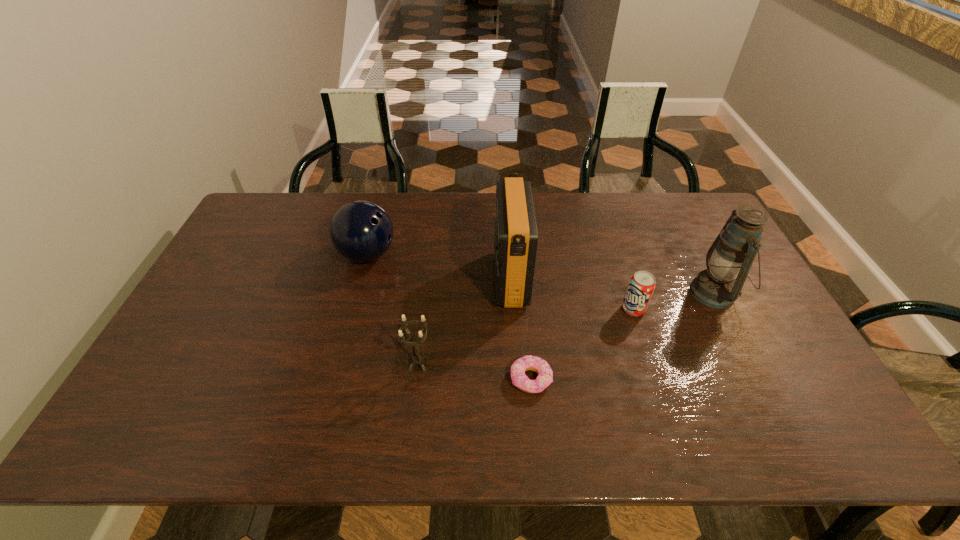
The width and height of the screenshot is (960, 540). I want to click on free space between the shortest object and the third shortest object, so click(474, 372).

You are a GUI agent. You are given a task and a screenshot of the screen. Output one action in this format:
    pyautogui.click(x=<x>, y=<y>)
    Task: Click on the empty location between the radio receiver and the leftmost object
    The image size is (960, 540).
    Given the screenshot: What is the action you would take?
    pyautogui.click(x=439, y=267)

Find the location of `blank region between the fifth object from left to right and the radio receiver`. blank region between the fifth object from left to right and the radio receiver is located at coordinates (572, 294).

The image size is (960, 540). What are the coordinates of `vacant space that's between the radio receiver and the doughnut` in the screenshot? It's located at (520, 329).

The height and width of the screenshot is (540, 960). I want to click on free space between the oil lamp and the fifth object from left to right, so click(x=674, y=301).

This screenshot has height=540, width=960. I want to click on vacant point located between the fifth object from right to left and the shortest object, so click(x=474, y=372).

Where is `free space between the fourth tallest object and the rightmost object`? free space between the fourth tallest object and the rightmost object is located at coordinates (566, 328).

This screenshot has width=960, height=540. I want to click on free space between the second object from left to right and the radio receiver, so click(465, 321).

This screenshot has width=960, height=540. I want to click on free space between the second shortest object and the shortest object, so click(582, 345).

Identify the location of vacant space that's between the doughnut and the radio receiver. (520, 329).